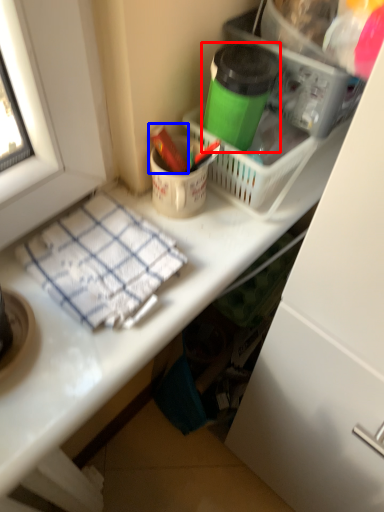
Question: Which point is further to the camera, bottle (highlighted by a red box) or crayon (highlighted by a blue box)?

Choices:
 (A) bottle
 (B) crayon

Answer: (B)